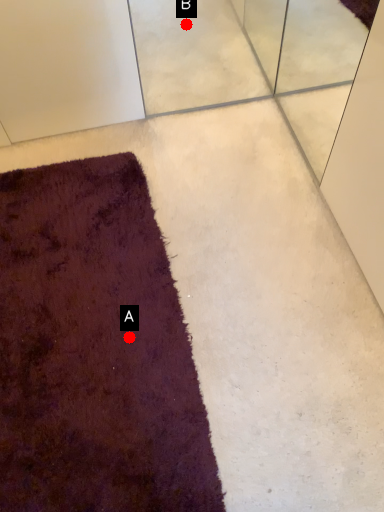
Question: Two points are circled on the image, labeled by A and B beside each circle. Among these points, which one is farthest from the camera?

Choices:
 (A) A is further
 (B) B is further

Answer: (B)